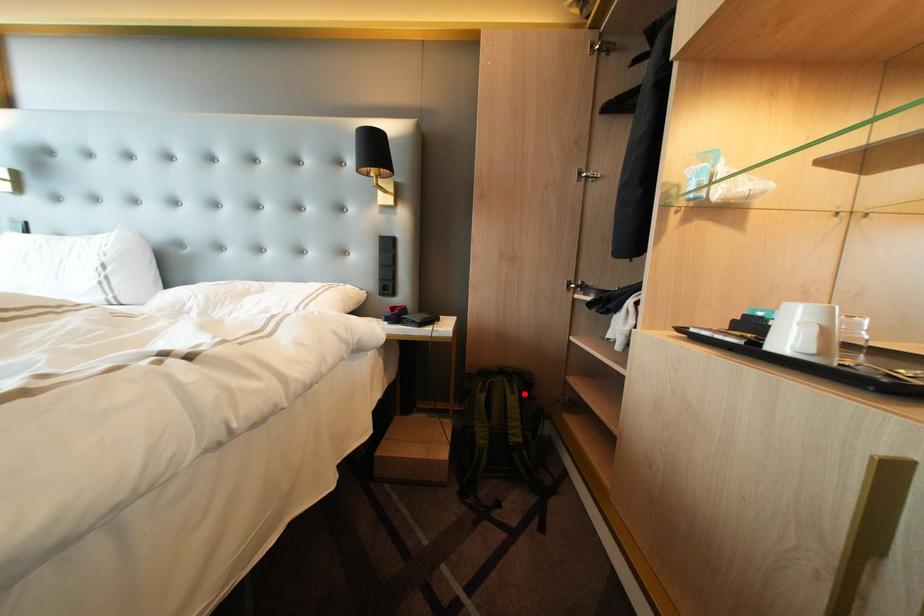
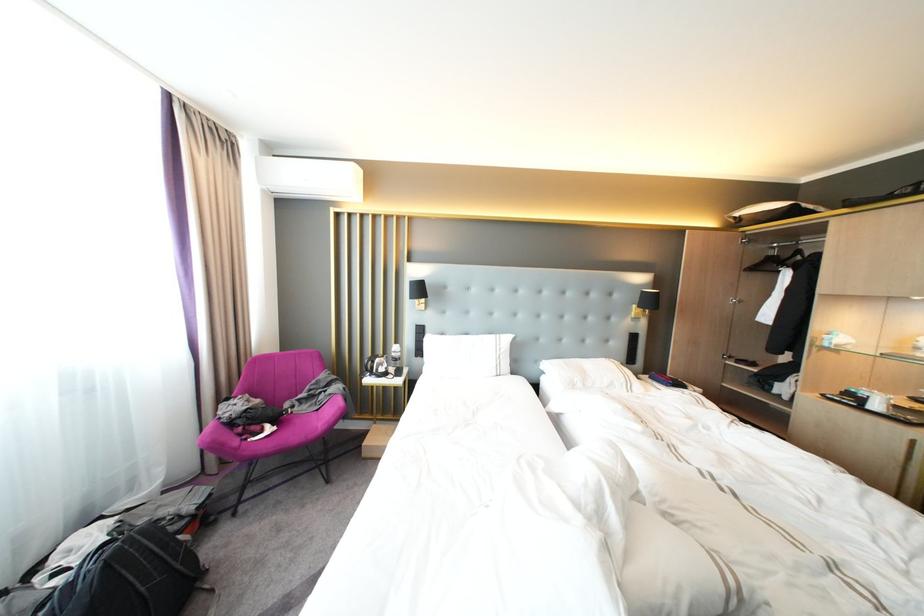
Question: I am providing you with two images of the same scene from different viewpoints. A red point is marked on the first image. Is the red point's position out of view in image 2?

Choices:
 (A) Yes
 (B) No

Answer: (A)